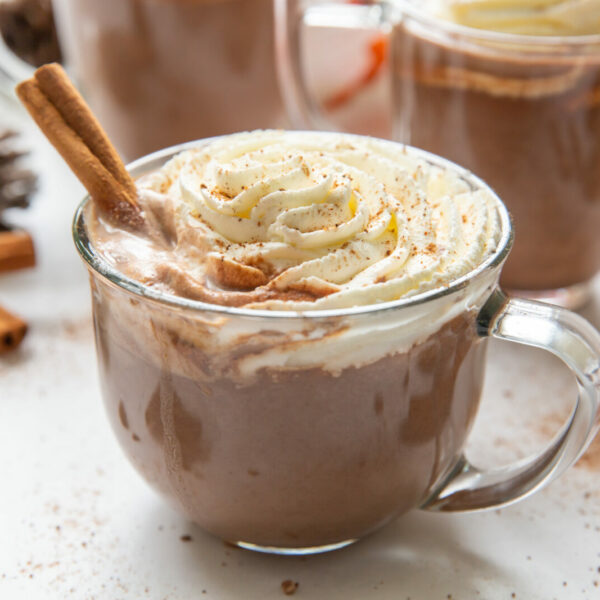
The image size is (600, 600). In order to click on mug in this screenshot , I will do `click(200, 53)`.